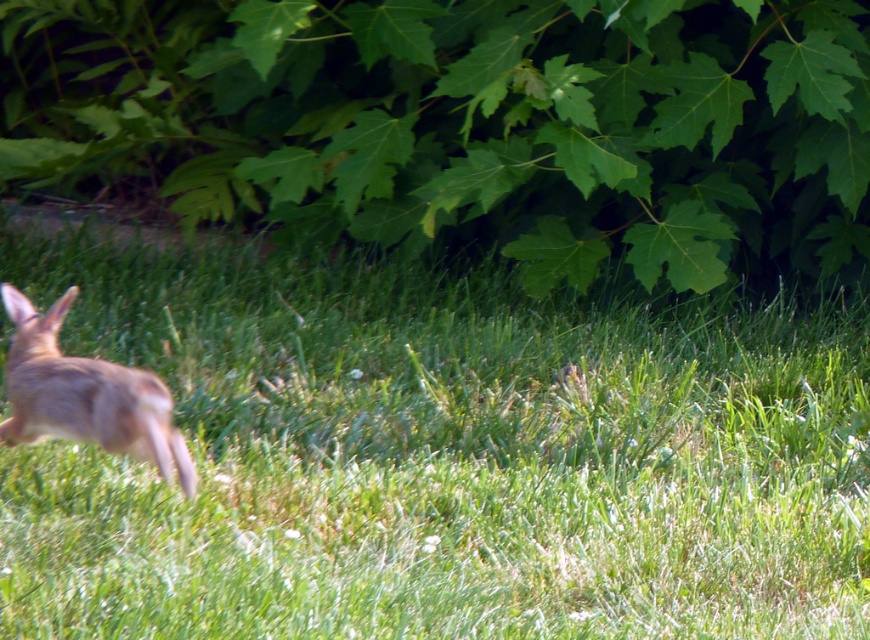
Question: Considering the relative positions of green grassy at center and furry brown rabbit at left in the image provided, where is green grassy at center located with respect to furry brown rabbit at left?

Choices:
 (A) above
 (B) below

Answer: (B)

Question: In this image, where is green grassy at center located relative to furry brown rabbit at left?

Choices:
 (A) below
 (B) above

Answer: (A)

Question: Which of the following is the farthest from the observer?

Choices:
 (A) green grassy at center
 (B) furry brown rabbit at left

Answer: (B)

Question: Which object appears farthest from the camera in this image?

Choices:
 (A) furry brown rabbit at left
 (B) green grassy at center

Answer: (A)

Question: Which of the following is the farthest from the observer?

Choices:
 (A) green grassy at center
 (B) furry brown rabbit at left

Answer: (B)

Question: Can you confirm if green grassy at center is thinner than furry brown rabbit at left?

Choices:
 (A) no
 (B) yes

Answer: (A)